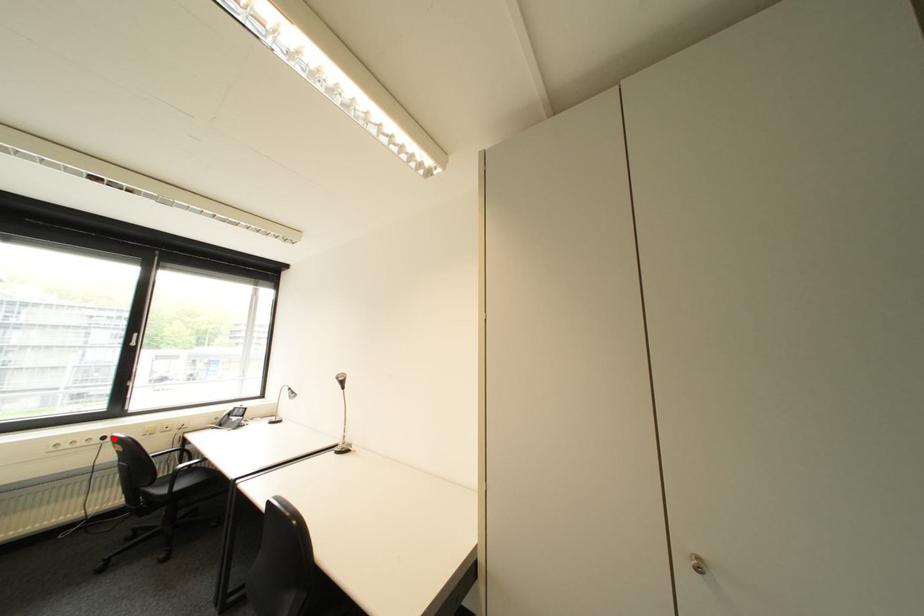
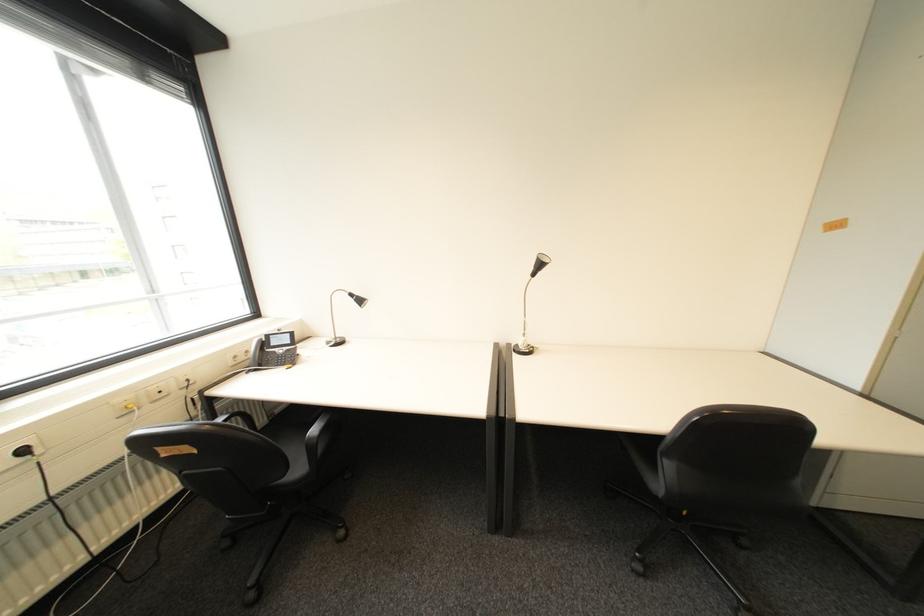
Locate, in the second image, the point that corresponds to the highlighted location in the first image.

(34, 452)